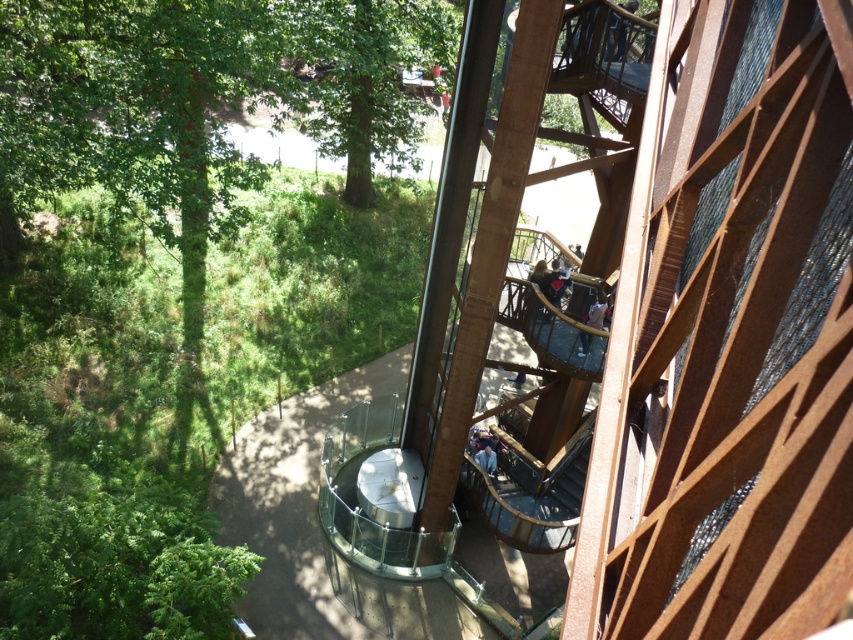
Does green leafy tree at left have a smaller size compared to green leafy tree at upper left?

Incorrect, green leafy tree at left is not smaller in size than green leafy tree at upper left.

Does green leafy tree at left appear on the right side of green leafy tree at upper left?

Incorrect, green leafy tree at left is not on the right side of green leafy tree at upper left.

This screenshot has height=640, width=853. What do you see at coordinates (192, 221) in the screenshot? I see `green leafy tree at left` at bounding box center [192, 221].

Find the location of `green leafy tree at left`. green leafy tree at left is located at coordinates (x=192, y=221).